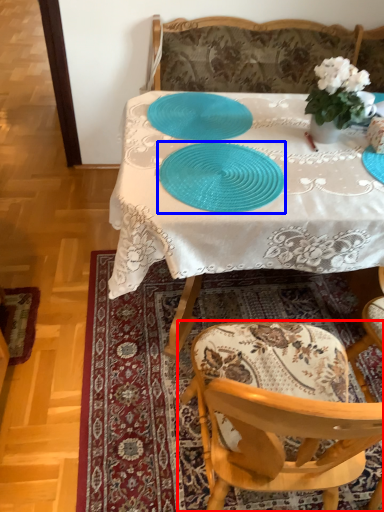
Question: Which of the following is the closest to the observer, chair (highlighted by a red box) or tableware (highlighted by a blue box)?

Choices:
 (A) chair
 (B) tableware

Answer: (A)